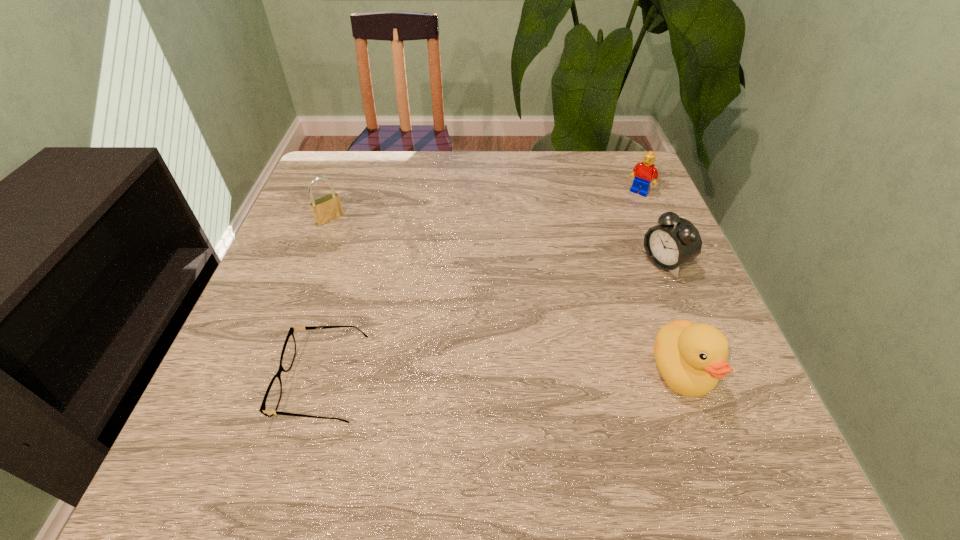
Where is `free space on the desktop that is between the shortest object and the duck and is positioned on the front side of the third farthest object`? The width and height of the screenshot is (960, 540). free space on the desktop that is between the shortest object and the duck and is positioned on the front side of the third farthest object is located at coordinates (451, 379).

The width and height of the screenshot is (960, 540). What are the coordinates of `free space on the desktop that is between the shortest object and the duck and is positioned on the front-facing side of the Lego` in the screenshot? It's located at (492, 377).

You are a GUI agent. You are given a task and a screenshot of the screen. Output one action in this format:
    pyautogui.click(x=<x>, y=<y>)
    Task: Click on the vacant space on the desktop that is between the shortest object and the duck and is positioned on the front-facing side of the padlock
    This screenshot has width=960, height=540.
    Given the screenshot: What is the action you would take?
    (502, 377)